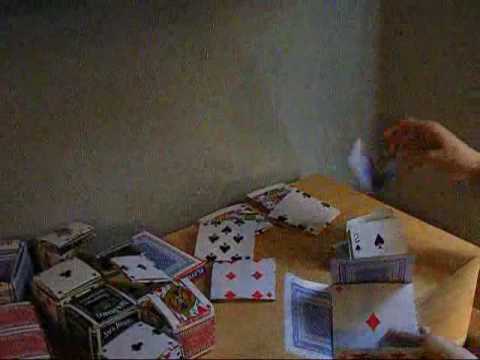
Image resolution: width=480 pixels, height=360 pixels. What are the coordinates of `wall` in the screenshot? It's located at (244, 92), (438, 84).